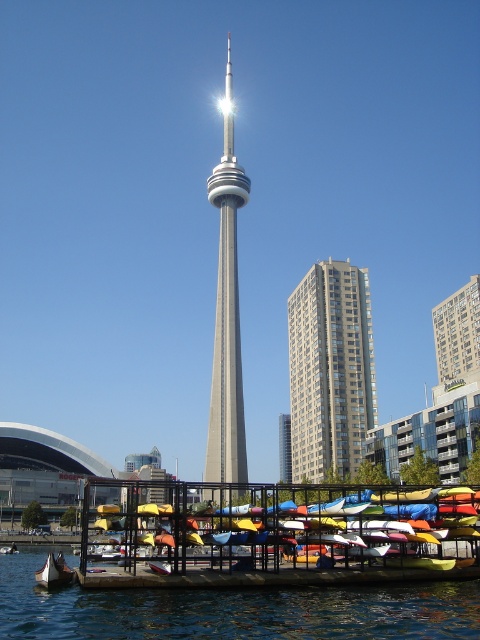
Question: Which object is positioned farthest from the multicolored plastic kayaks at lower center?

Choices:
 (A) silver metallic cn tower at center
 (B) transparent water at lower center

Answer: (A)

Question: Is multicolored plastic kayaks at lower center positioned in front of silver metallic cn tower at center?

Choices:
 (A) no
 (B) yes

Answer: (B)

Question: Considering the relative positions of silver metallic cn tower at center and gray concrete building at center in the image provided, where is silver metallic cn tower at center located with respect to gray concrete building at center?

Choices:
 (A) left
 (B) right

Answer: (A)

Question: Which point is farther to the camera?

Choices:
 (A) (474, 280)
 (B) (289, 307)
 (C) (319, 596)
 (D) (72, 570)

Answer: (A)

Question: Considering the real-world distances, which object is closest to the silver metallic cn tower at center?

Choices:
 (A) gray concrete building at center
 (B) transparent water at lower center
 (C) beige concrete building at center

Answer: (C)

Question: Does multicolored plastic kayaks at lower center appear over gray concrete building at center?

Choices:
 (A) yes
 (B) no

Answer: (B)